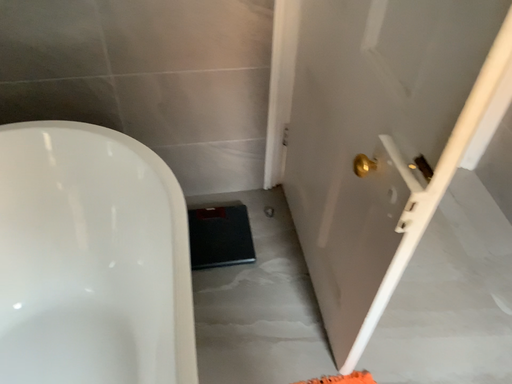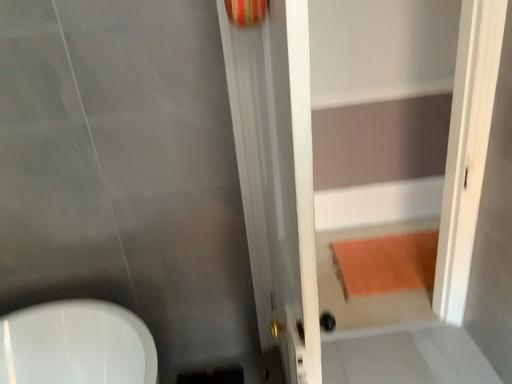
Question: How did the camera likely rotate when shooting the video?

Choices:
 (A) rotated right
 (B) rotated left

Answer: (B)